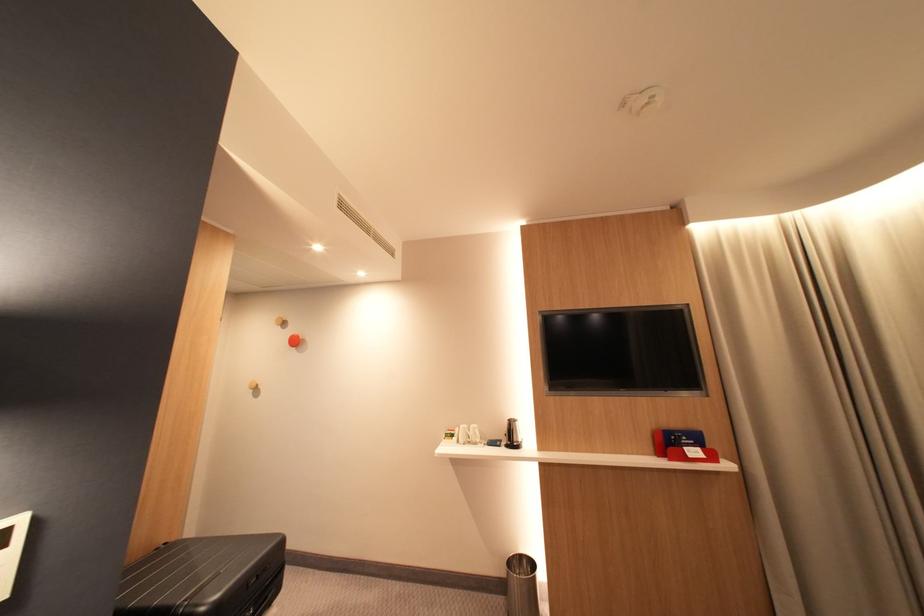
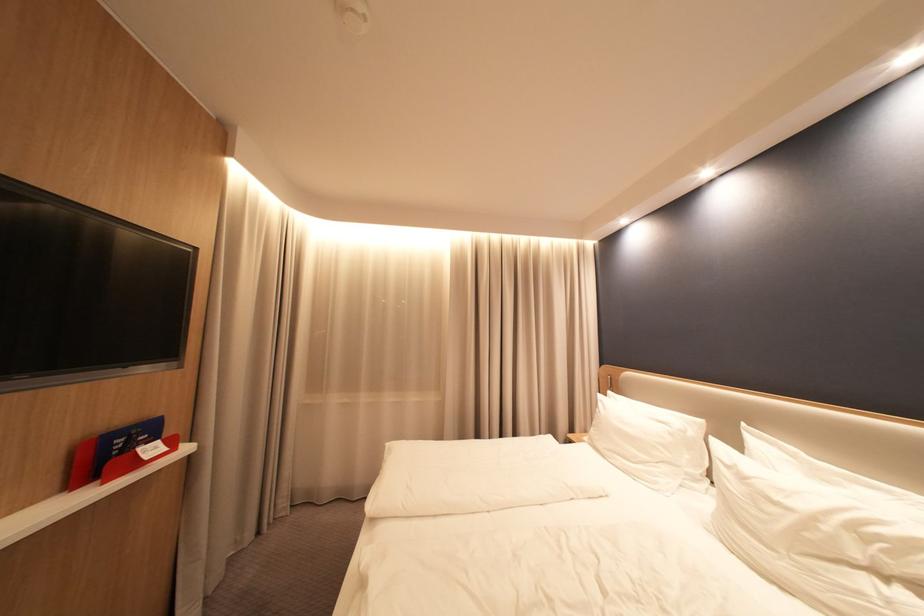
Locate, in the second image, the point that corresponds to point 706,439 in the first image.

(160, 431)